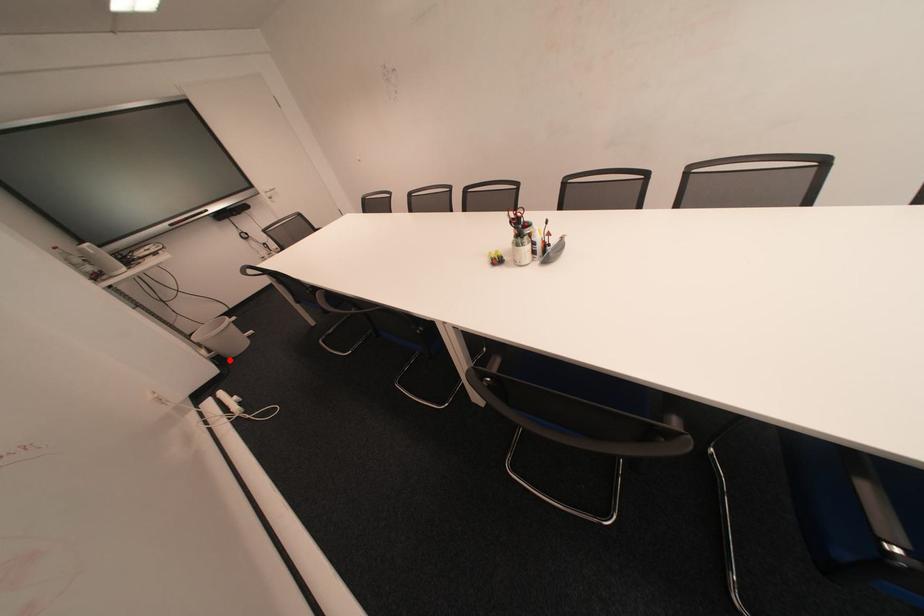
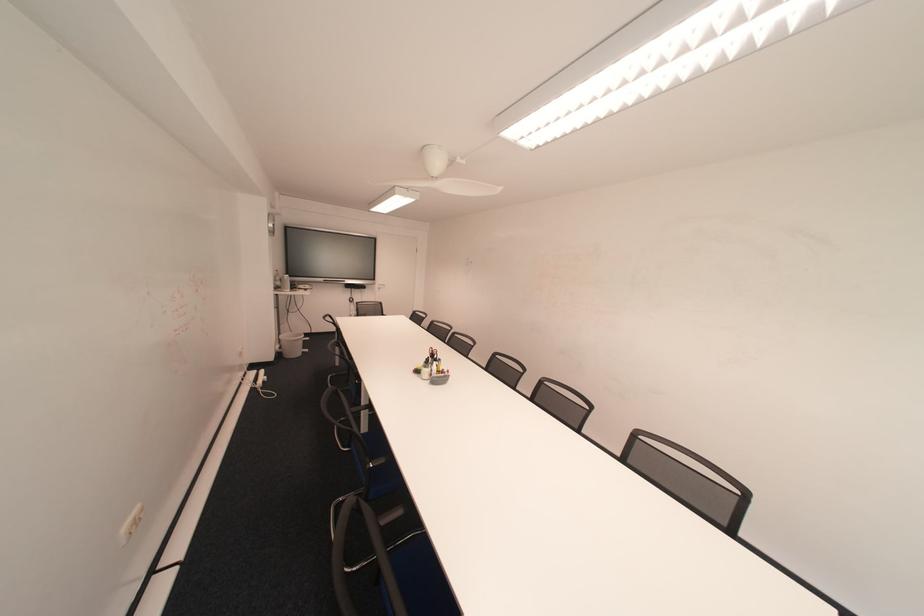
Locate, in the second image, the point that corresponds to the highlighted location in the first image.

(290, 355)